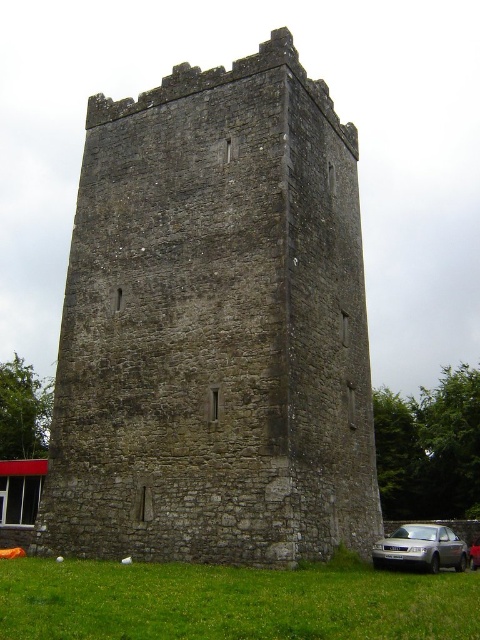
Consider the image. You are a visitor at the medieval tower and want to take a photo of the tower with your camera. You have to decide between standing on the green grass at lower center or the silver metallic car at lower right. Which location would give you a wider field of view for the tower?

The green grass at lower center is bigger than the silver metallic car at lower right, so standing on the green grass at lower center would provide a wider field of view for the tower.